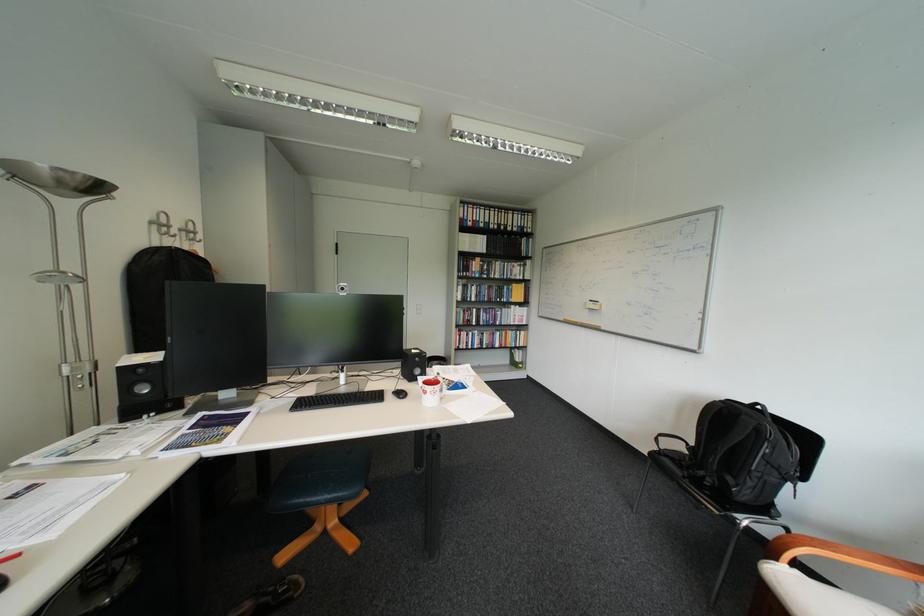
Where would you adjust the black webcam? Please return your answer as a coordinate pair (x, y).

(342, 289)